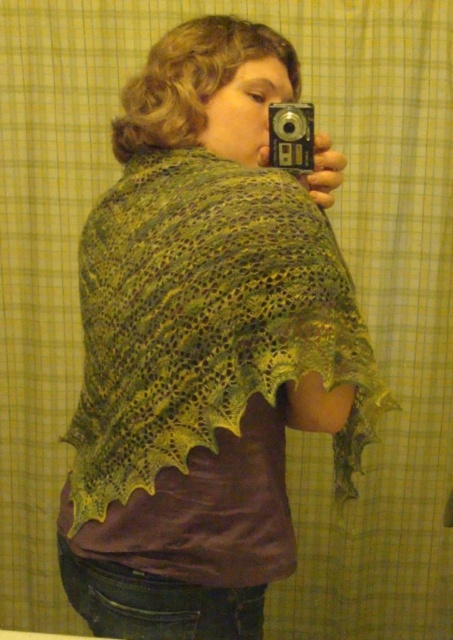
Question: Which point is farther from the camera taking this photo?

Choices:
 (A) (298, 148)
 (B) (198, 160)

Answer: (A)

Question: Which object appears closest to the camera in this image?

Choices:
 (A) silver metallic camera at upper center
 (B) green lace shawl at upper center

Answer: (B)

Question: Is green lace shawl at upper center smaller than silver metallic camera at upper center?

Choices:
 (A) yes
 (B) no

Answer: (B)

Question: Observing the image, what is the correct spatial positioning of green lace shawl at upper center in reference to silver metallic camera at upper center?

Choices:
 (A) below
 (B) above

Answer: (A)

Question: Does green lace shawl at upper center appear under silver metallic camera at upper center?

Choices:
 (A) no
 (B) yes

Answer: (B)